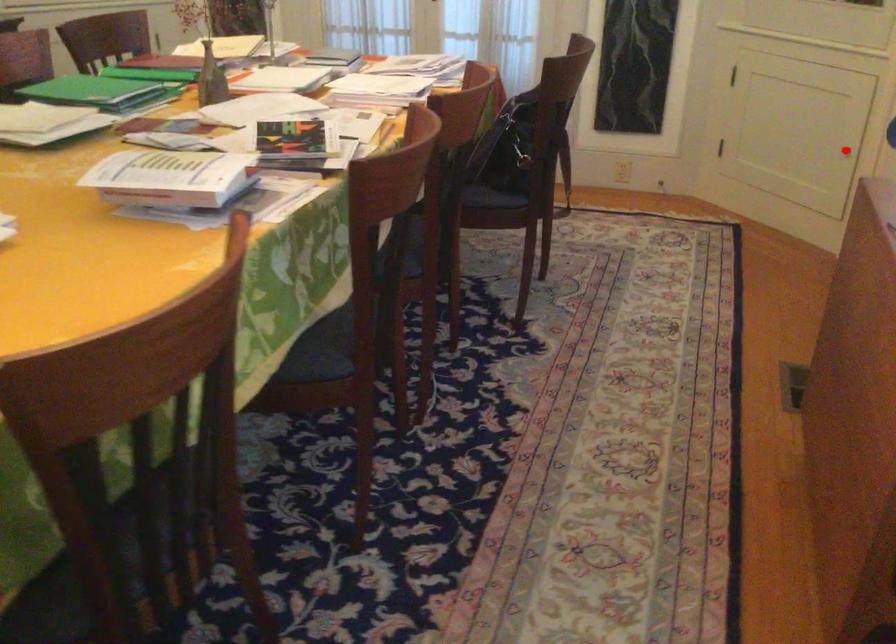
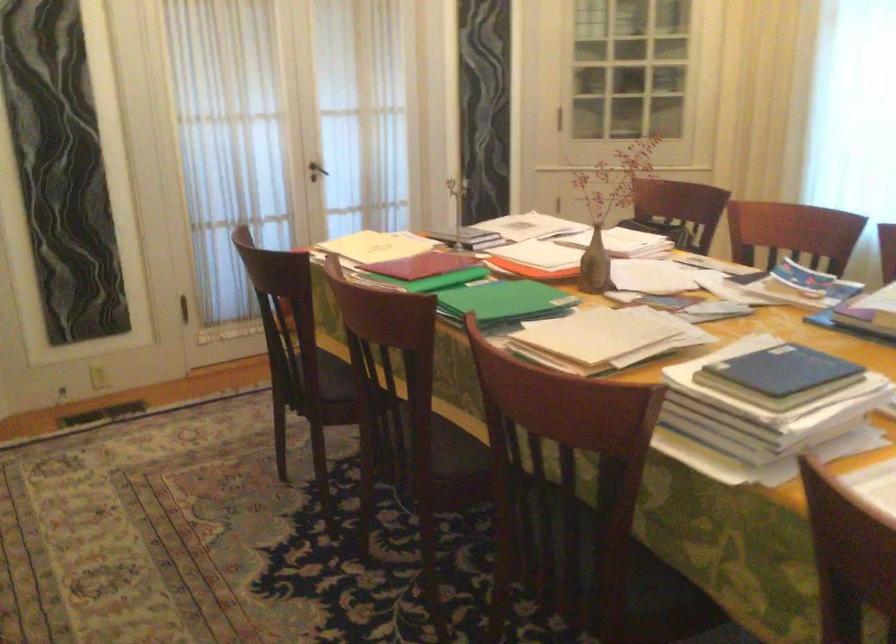
Question: I am providing you with two images of the same scene from different viewpoints. A red point is marked on the first image. Can you still see the location of the red point in image 2?

Choices:
 (A) Yes
 (B) No

Answer: (B)